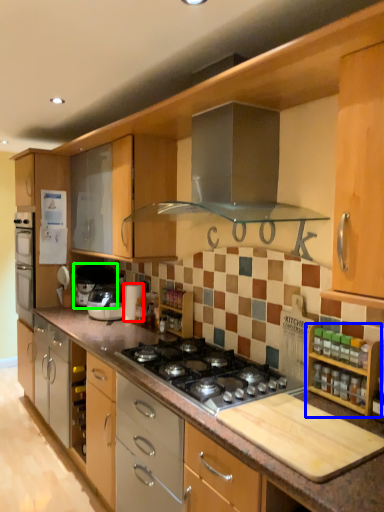
Question: Which is farther away from appliance (highlighted by a red box)? cabinetry (highlighted by a blue box) or appliance (highlighted by a green box)?

Choices:
 (A) cabinetry
 (B) appliance

Answer: (A)